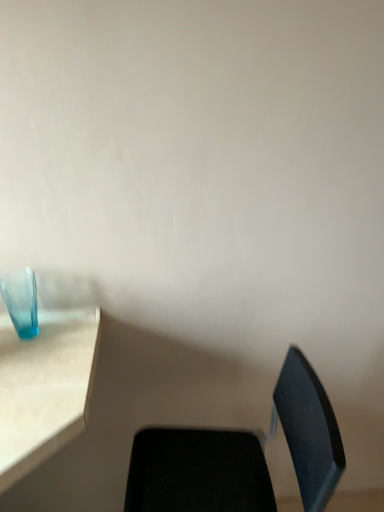
This screenshot has height=512, width=384. What do you see at coordinates (241, 456) in the screenshot? I see `black fabric chair at lower right` at bounding box center [241, 456].

Find the location of `black fabric chair at lower right`. black fabric chair at lower right is located at coordinates (241, 456).

Measure the distance between black fabric chair at lower right and camera.

The distance of black fabric chair at lower right from camera is 37.51 inches.

I want to click on black fabric chair at lower right, so click(x=241, y=456).